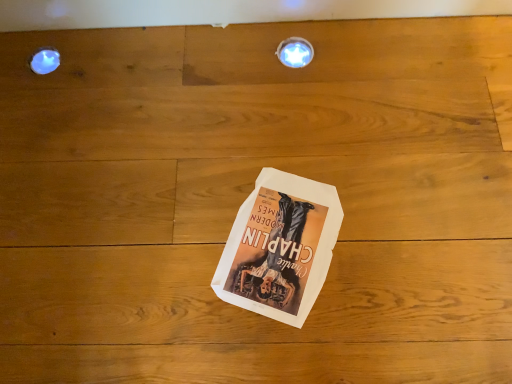
I want to click on vacant space behind white paper at center, so (265, 134).